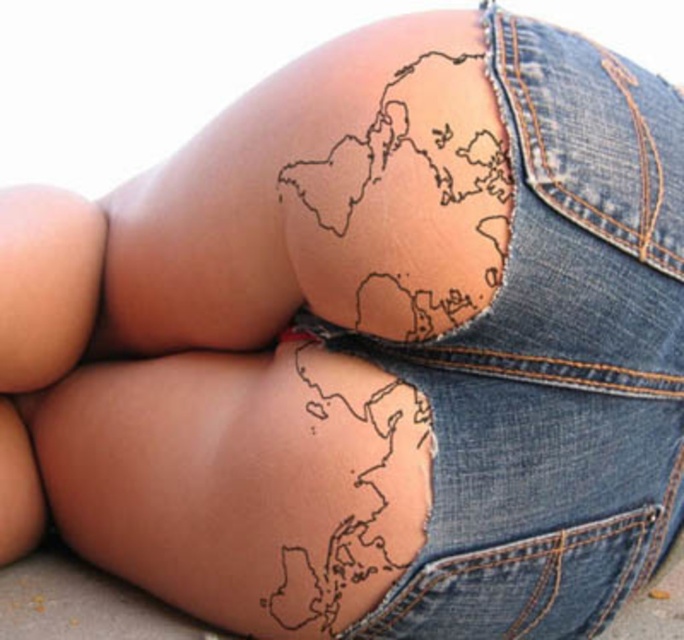
You are a photographer standing at a distance. You want to take a closeup shot of the point at coordinate (x=578, y=124). The camera you are using has a minimum focusing distance of 30 inches. Can you take the photo without moving closer?

The point at coordinate (x=578, y=124) is 32.09 inches away from the viewer. Since the minimum focusing distance is 30 inches, the camera can focus on the point as it is within the required range. Therefore, you can take the photo without moving closer.